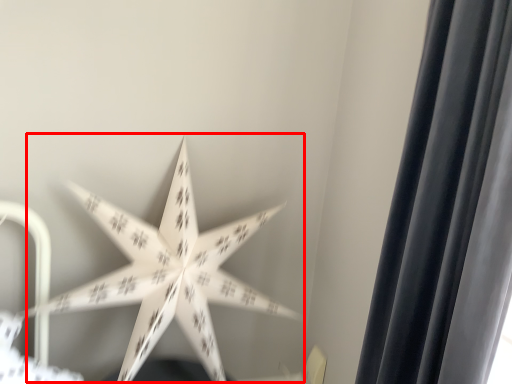
Question: Observing the image, what is the correct spatial positioning of star (annotated by the red box) in reference to curtain?

Choices:
 (A) right
 (B) left

Answer: (B)